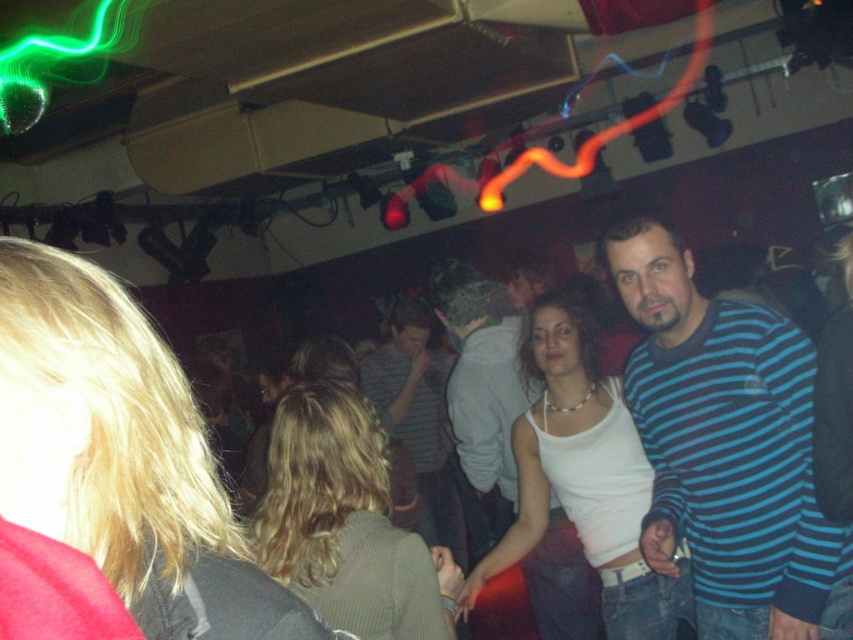
Question: Which of the following is the closest to the observer?

Choices:
 (A) (434, 566)
 (B) (1, 304)
 (C) (448, 490)

Answer: (B)

Question: Which of the following is the farthest from the observer?

Choices:
 (A) (606, 412)
 (B) (361, 480)
 (C) (428, 458)

Answer: (C)

Question: Can you confirm if blonde hair at upper left is bigger than white matte tank top at center?

Choices:
 (A) yes
 (B) no

Answer: (B)

Question: Can you confirm if blonde hair at upper left is positioned to the left of white matte tank top at center?

Choices:
 (A) yes
 (B) no

Answer: (A)

Question: Based on their relative distances, which object is farther from the white matte tank top at center?

Choices:
 (A) blonde hair at center
 (B) blonde hair at upper left

Answer: (B)

Question: Observing the image, what is the correct spatial positioning of blonde hair at upper left in reference to striped cotton shirt at center?

Choices:
 (A) above
 (B) below

Answer: (A)